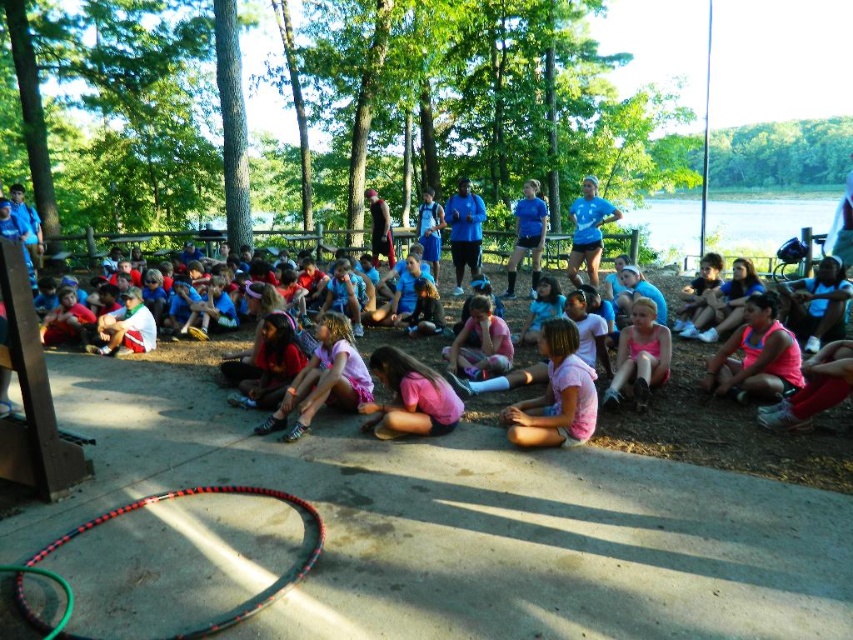
You are standing at the edge of the concrete platform where the group is gathered. You see the multicolored plastic hula hoop at lower center and the blue fabric shorts at center. Which object is positioned to the left of the other?

The multicolored plastic hula hoop at lower center is to the left of blue fabric shorts at center.

You are standing on the concrete platform where the group is seated. You want to reach the blue fabric shorts at center without stepping into the clear blue water at upper center. Is this possible?

The clear blue water at upper center is further to the viewer than the blue fabric shorts at center, so you can reach the blue fabric shorts at center without stepping into the water as they are closer to you and the water is behind them.

You are a parent at the campsite and want to ensure your child stays within a safe distance from the water. If the blue fabric shorts at center belong to your child, which direction should they move to stay away from the clear blue water at upper center?

The clear blue water at upper center is positioned on the right side of blue fabric shorts at center. To stay away from the water, the child should move to the left side away from the clear blue water at upper center.